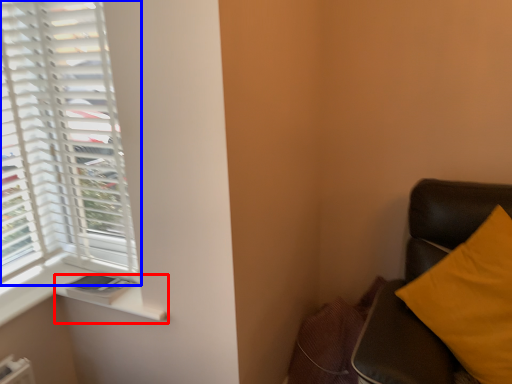
Question: Which object is closer to the camera taking this photo, window sill (highlighted by a red box) or window (highlighted by a blue box)?

Choices:
 (A) window sill
 (B) window

Answer: (B)